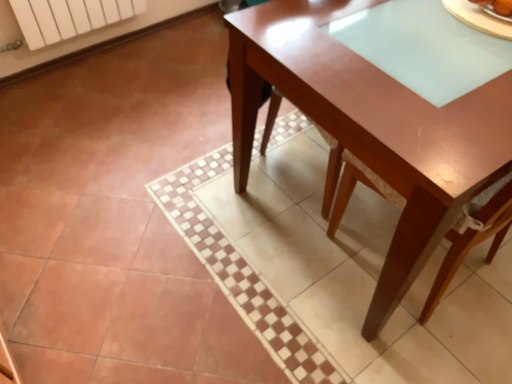
Question: Should I look upward or downward to see smooth brown bread at upper right?

Choices:
 (A) down
 (B) up

Answer: (B)

Question: Considering the relative sizes of glossy wood table at center and white matte radiator at upper left in the image provided, is glossy wood table at center smaller than white matte radiator at upper left?

Choices:
 (A) yes
 (B) no

Answer: (B)

Question: From a real-world perspective, is glossy wood table at center physically above white matte radiator at upper left?

Choices:
 (A) no
 (B) yes

Answer: (B)

Question: Is white matte radiator at upper left completely or partially inside glossy wood table at center?

Choices:
 (A) yes
 (B) no

Answer: (B)

Question: Is glossy wood table at center aimed at white matte radiator at upper left?

Choices:
 (A) no
 (B) yes

Answer: (A)

Question: Is glossy wood table at center placed right next to white matte radiator at upper left?

Choices:
 (A) no
 (B) yes

Answer: (A)

Question: Considering the relative sizes of glossy wood table at center and white matte radiator at upper left in the image provided, is glossy wood table at center taller than white matte radiator at upper left?

Choices:
 (A) no
 (B) yes

Answer: (B)

Question: From the image's perspective, is white matte radiator at upper left above glossy wood table at center?

Choices:
 (A) no
 (B) yes

Answer: (B)

Question: Is the position of white matte radiator at upper left less distant than that of glossy wood table at center?

Choices:
 (A) yes
 (B) no

Answer: (B)

Question: Does white matte radiator at upper left come behind glossy wood table at center?

Choices:
 (A) no
 (B) yes

Answer: (B)

Question: From a real-world perspective, is white matte radiator at upper left positioned over glossy wood table at center based on gravity?

Choices:
 (A) yes
 (B) no

Answer: (B)

Question: Does white matte radiator at upper left have a smaller size compared to glossy wood table at center?

Choices:
 (A) yes
 (B) no

Answer: (A)

Question: Is white matte radiator at upper left facing towards glossy wood table at center?

Choices:
 (A) yes
 (B) no

Answer: (A)

Question: Considering the relative sizes of smooth brown bread at upper right and glossy wood table at center in the image provided, is smooth brown bread at upper right wider than glossy wood table at center?

Choices:
 (A) no
 (B) yes

Answer: (A)